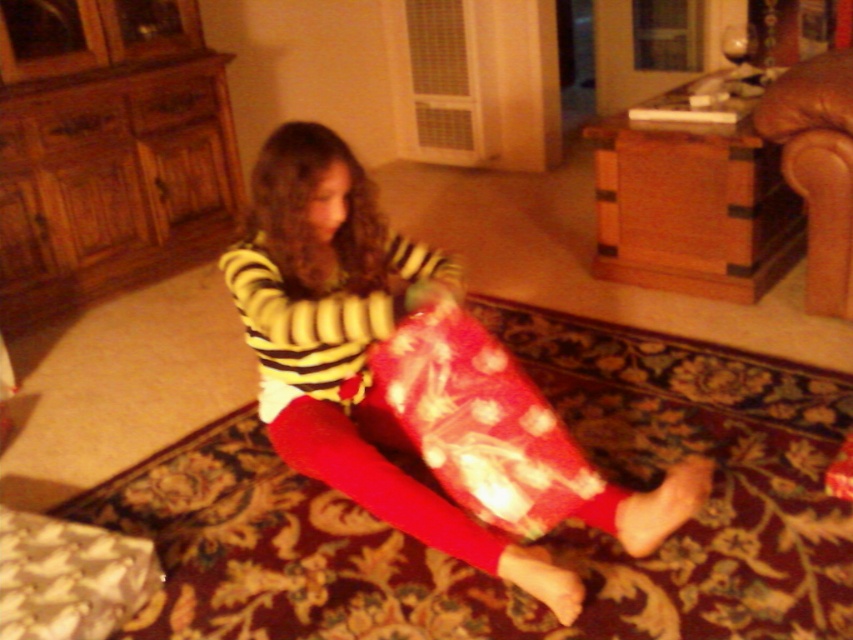
Question: Is shiny red wrapping paper at lower center wider than brown leather armchair at upper right?

Choices:
 (A) yes
 (B) no

Answer: (A)

Question: Can you confirm if matte red leggings at center is smaller than brown leather armchair at upper right?

Choices:
 (A) no
 (B) yes

Answer: (A)

Question: Which point is closer to the camera?

Choices:
 (A) (820, 106)
 (B) (364, 234)
 (C) (460, 342)

Answer: (C)

Question: Which is nearer to the matte red leggings at center?

Choices:
 (A) shiny red wrapping paper at lower center
 (B) brown leather armchair at upper right

Answer: (A)

Question: Where is shiny red wrapping paper at lower center located in relation to brown leather armchair at upper right in the image?

Choices:
 (A) right
 (B) left

Answer: (B)

Question: Which object appears closest to the camera in this image?

Choices:
 (A) brown leather armchair at upper right
 (B) matte red leggings at center
 (C) shiny red wrapping paper at lower center

Answer: (B)